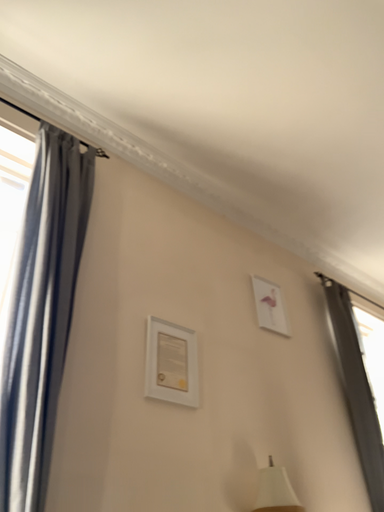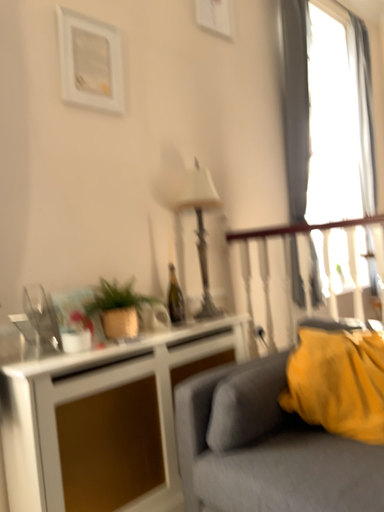
Question: Which way did the camera rotate in the video?

Choices:
 (A) rotated upward
 (B) rotated downward

Answer: (B)